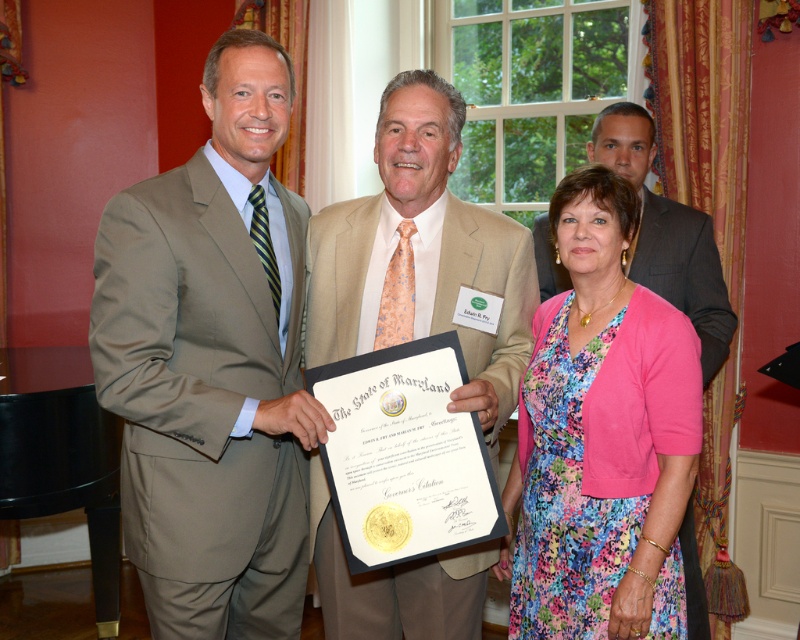
Is floral dress at center bigger than light beige suit at center?

No, floral dress at center is not bigger than light beige suit at center.

What do you see at coordinates (601, 436) in the screenshot? Image resolution: width=800 pixels, height=640 pixels. I see `floral dress at center` at bounding box center [601, 436].

Which is in front, point (562, 467) or point (320, 305)?

Positioned in front is point (562, 467).

The image size is (800, 640). In order to click on floral dress at center in this screenshot , I will do `click(601, 436)`.

Can you confirm if satin tan suit at center is smaller than floral dress at center?

No, satin tan suit at center is not smaller than floral dress at center.

Which is behind, point (254, 508) or point (545, 417)?

Point (545, 417)

Who is more distant from viewer, (180, 358) or (570, 518)?

The point (570, 518) is more distant.

Identify the location of satin tan suit at center. The width and height of the screenshot is (800, 640). (212, 364).

Which of these two, satin tan suit at center or light beige suit at center, stands taller?

satin tan suit at center is taller.

Who is shorter, satin tan suit at center or light beige suit at center?

With less height is light beige suit at center.

The height and width of the screenshot is (640, 800). In order to click on satin tan suit at center in this screenshot , I will do `click(212, 364)`.

Locate an element on the screen. The height and width of the screenshot is (640, 800). satin tan suit at center is located at coordinates (212, 364).